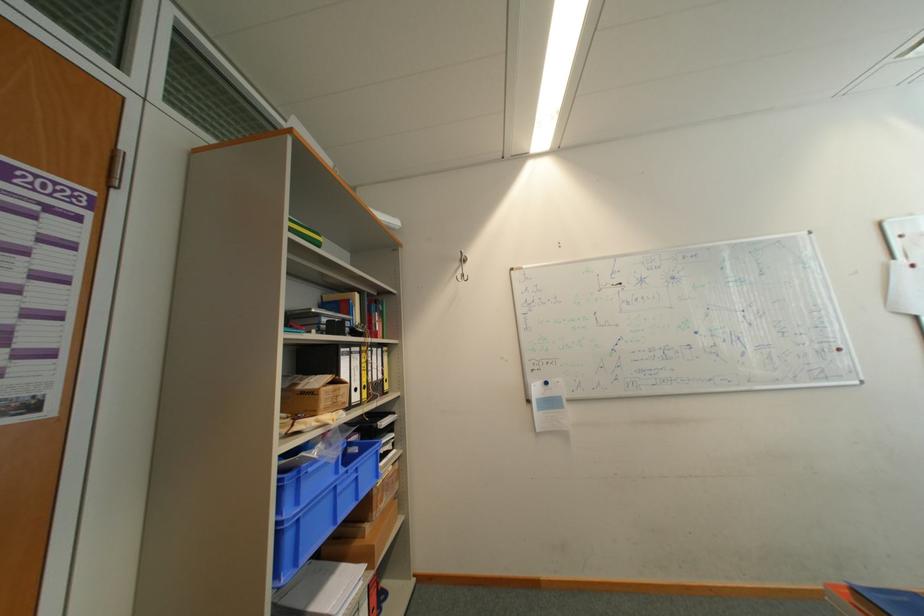
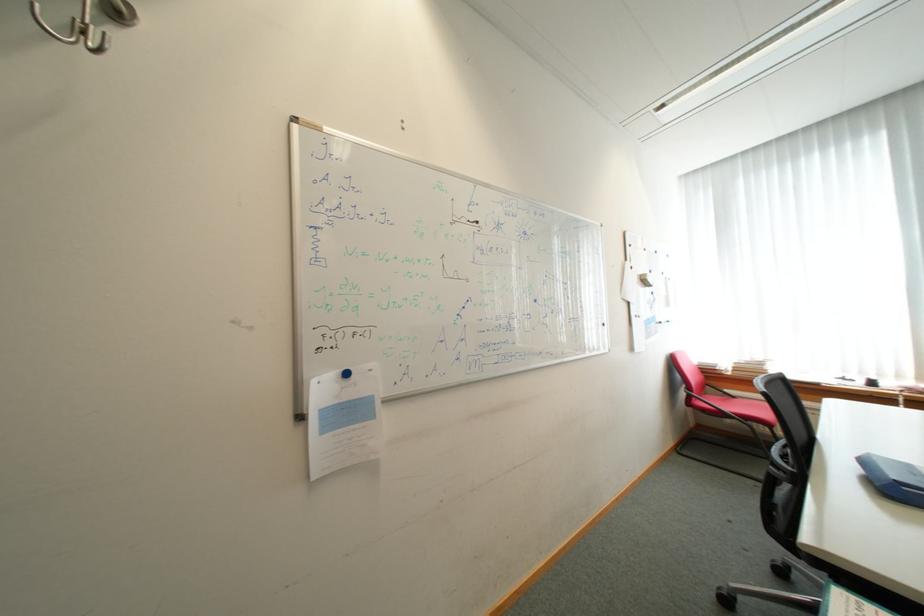
Question: The camera is either moving clockwise (left) or counter-clockwise (right) around the object. The first image is from the beginning of the video and the second image is from the end. Is the camera moving left or right when shooting the video?

Choices:
 (A) Left
 (B) Right

Answer: (A)